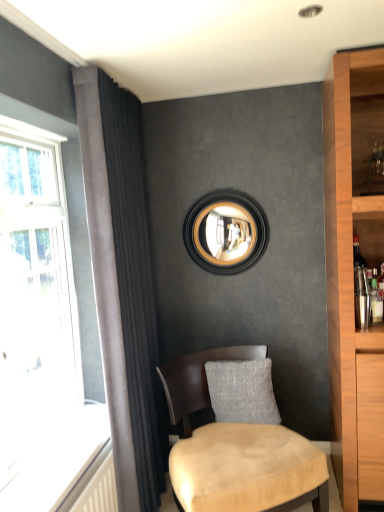
Question: Is point (115, 245) closer or farther from the camera than point (218, 406)?

Choices:
 (A) farther
 (B) closer

Answer: (B)

Question: Visually, is dark grey velvet curtain at left positioned to the left or to the right of gray textured pillow at center?

Choices:
 (A) right
 (B) left

Answer: (B)

Question: Which of these objects is positioned farthest from the gray textured pillow at center?

Choices:
 (A) suede beige chair at lower center
 (B) black wood picture frame at upper center
 (C) dark grey velvet curtain at left

Answer: (B)

Question: Which of these objects is positioned farthest from the black wood picture frame at upper center?

Choices:
 (A) suede beige chair at lower center
 (B) gray textured pillow at center
 (C) dark grey velvet curtain at left

Answer: (A)